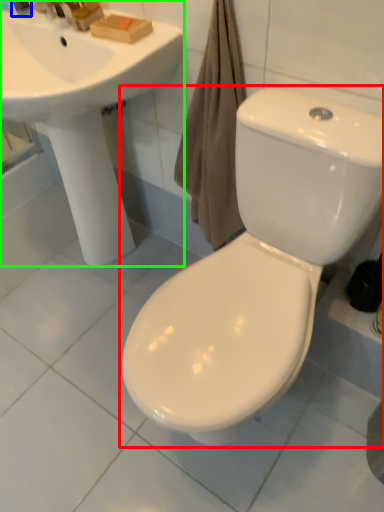
Question: Estimate the real-world distances between objects in this image. Which object is closer to toilet (highlighted by a red box), toiletry (highlighted by a blue box) or sink (highlighted by a green box)?

Choices:
 (A) toiletry
 (B) sink

Answer: (B)